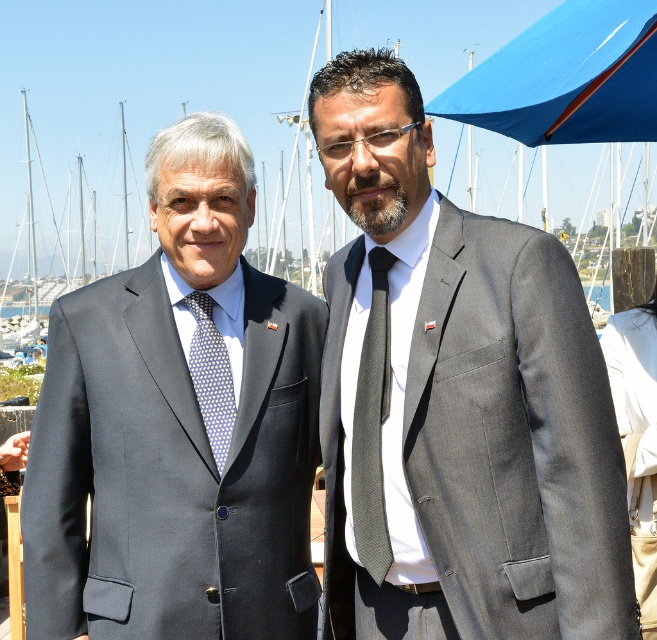
This screenshot has width=657, height=640. Describe the element at coordinates (514, 436) in the screenshot. I see `matte gray suit at center` at that location.

Is matte gray suit at center wider than blue dotted tie at left?

Correct, the width of matte gray suit at center exceeds that of blue dotted tie at left.

What do you see at coordinates (514, 436) in the screenshot? The image size is (657, 640). I see `matte gray suit at center` at bounding box center [514, 436].

You are a GUI agent. You are given a task and a screenshot of the screen. Output one action in this format:
    pyautogui.click(x=<x>, y=<y>)
    Task: Click on the matte gray suit at center
    The image size is (657, 640).
    Given the screenshot: What is the action you would take?
    pyautogui.click(x=514, y=436)

Can you confirm if matte black suit at center is smaller than matte gray suit at center?

No.

Between matte black suit at center and matte gray suit at center, which one appears on the left side from the viewer's perspective?

matte black suit at center is more to the left.

Identify the location of matte black suit at center. (177, 426).

Where is `matte black suit at center`? The height and width of the screenshot is (640, 657). matte black suit at center is located at coordinates click(x=177, y=426).

Is matte black suit at center thinner than blue dotted tie at left?

No.

Does matte black suit at center appear over blue dotted tie at left?

No, matte black suit at center is not above blue dotted tie at left.

What do you see at coordinates (177, 426) in the screenshot? I see `matte black suit at center` at bounding box center [177, 426].

The image size is (657, 640). In order to click on matte black suit at center in this screenshot , I will do `click(177, 426)`.